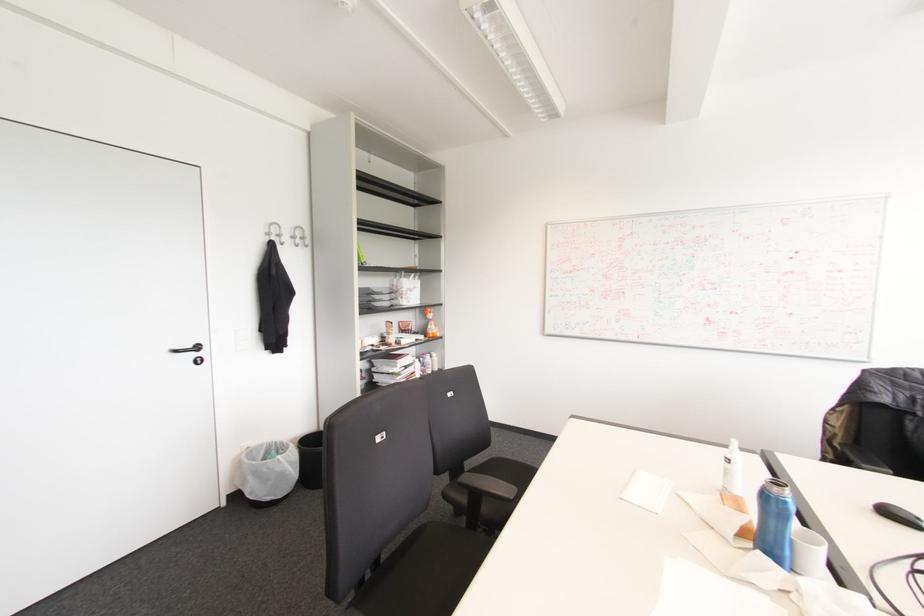
The height and width of the screenshot is (616, 924). I want to click on white coffee mug, so click(x=808, y=553).